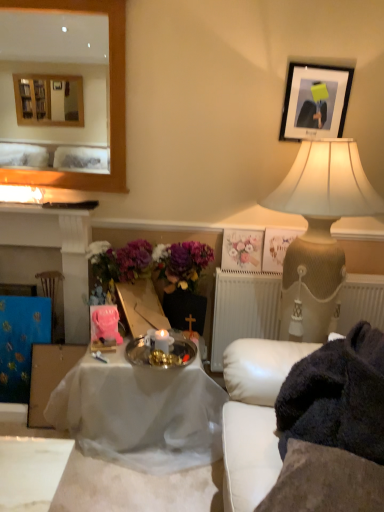
Question: Should I look upward or downward to see dark gray fabric at lower right?

Choices:
 (A) down
 (B) up

Answer: (A)

Question: Is dark gray fabric at lower right facing away from beige textured lamp at upper right?

Choices:
 (A) no
 (B) yes

Answer: (B)

Question: Considering the relative sizes of dark gray fabric at lower right and beige textured lamp at upper right in the image provided, is dark gray fabric at lower right wider than beige textured lamp at upper right?

Choices:
 (A) yes
 (B) no

Answer: (B)

Question: Considering the relative sizes of dark gray fabric at lower right and beige textured lamp at upper right in the image provided, is dark gray fabric at lower right thinner than beige textured lamp at upper right?

Choices:
 (A) yes
 (B) no

Answer: (A)

Question: Are dark gray fabric at lower right and beige textured lamp at upper right beside each other?

Choices:
 (A) no
 (B) yes

Answer: (A)

Question: Can you confirm if dark gray fabric at lower right is positioned to the right of beige textured lamp at upper right?

Choices:
 (A) yes
 (B) no

Answer: (B)

Question: From the image's perspective, is dark gray fabric at lower right beneath beige textured lamp at upper right?

Choices:
 (A) no
 (B) yes

Answer: (B)

Question: Could you tell me if silver metallic tray at center is turned towards white leather couch at right?

Choices:
 (A) no
 (B) yes

Answer: (A)

Question: Is silver metallic tray at center next to white leather couch at right?

Choices:
 (A) yes
 (B) no

Answer: (B)

Question: Can you confirm if silver metallic tray at center is shorter than white leather couch at right?

Choices:
 (A) yes
 (B) no

Answer: (A)

Question: From a real-world perspective, is silver metallic tray at center beneath white leather couch at right?

Choices:
 (A) no
 (B) yes

Answer: (B)

Question: Considering the relative sizes of silver metallic tray at center and white leather couch at right in the image provided, is silver metallic tray at center thinner than white leather couch at right?

Choices:
 (A) no
 (B) yes

Answer: (B)

Question: From the image's perspective, is silver metallic tray at center below white leather couch at right?

Choices:
 (A) yes
 (B) no

Answer: (B)

Question: Is matte black fireplace at left located within beige textured lamp at upper right?

Choices:
 (A) no
 (B) yes

Answer: (A)